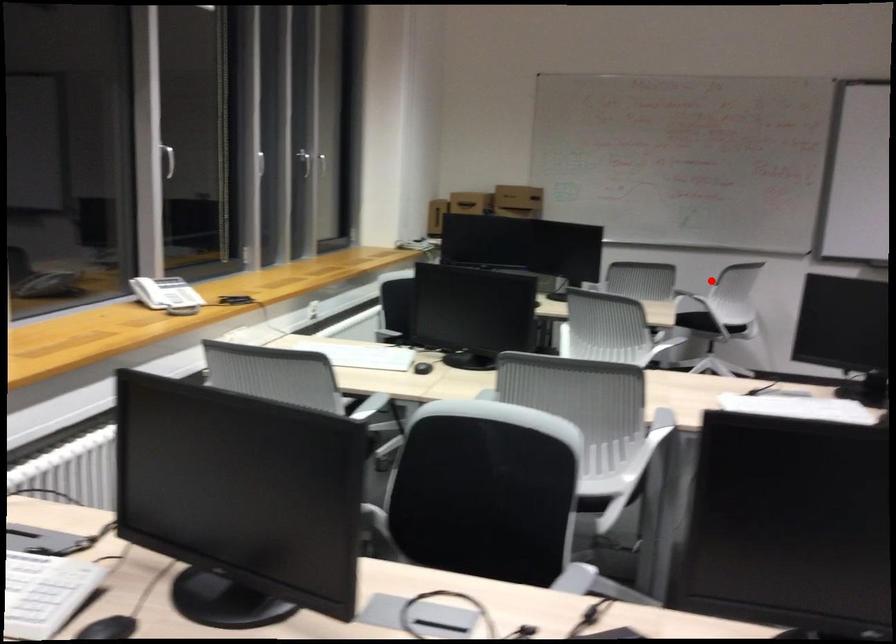
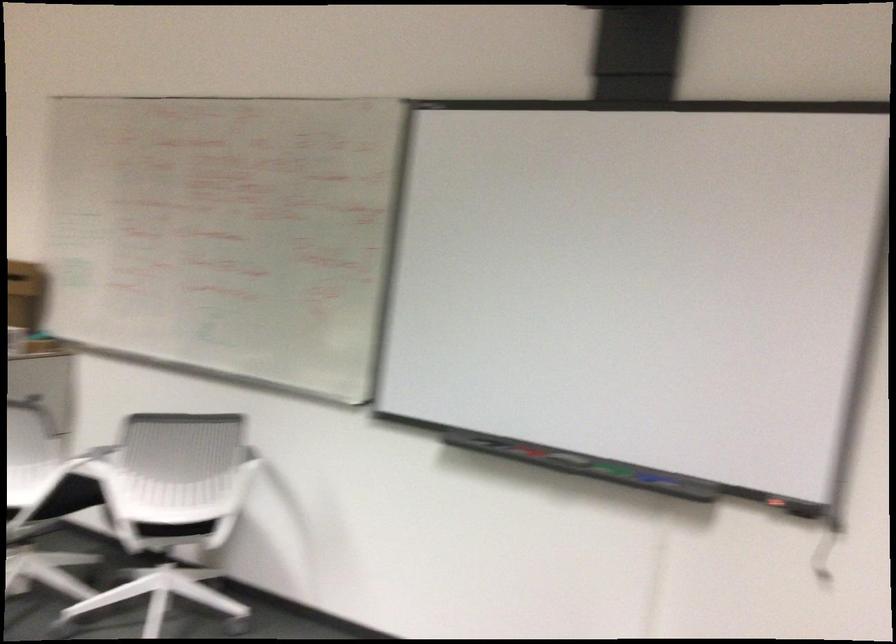
Question: A red point is marked in image1. In image2, is the corresponding 3D point closer to the camera or farther? Reply with the corresponding letter.

Choices:
 (A) The corresponding 3D point is closer.
 (B) The corresponding 3D point is farther.

Answer: (A)